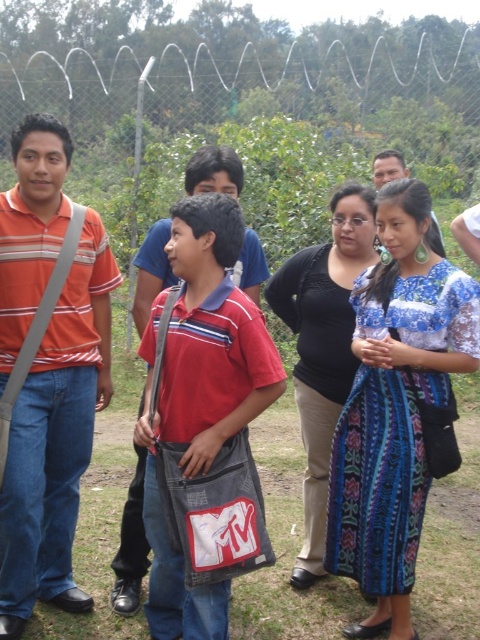
Based on the coordinates provided, which object corresponds to the point at (56, 438) in the scene?

The point at (56, 438) corresponds to the matte striped shirt at left.

You are a photographer trying to capture a detailed shot of the blue woven skirt at center and the denim jeans at center. Which item should you focus on first to ensure both are in focus without adjusting the camera settings?

The blue woven skirt at center is closer to the viewer than the denim jeans at center, so focus on the blue woven skirt at center first. This way, since it is closer, the denim jeans at center will naturally fall into the depth of field once the closer object is in focus.